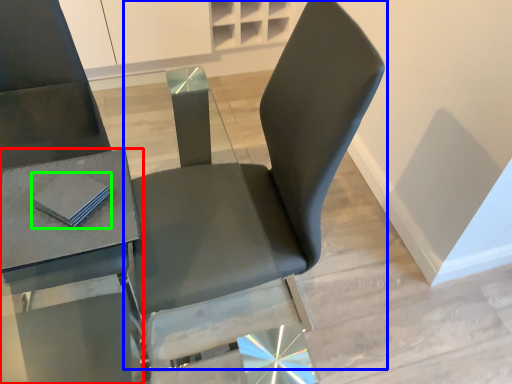
Question: Which is farther away from table (highlighted by a red box)? chair (highlighted by a blue box) or pad (highlighted by a green box)?

Choices:
 (A) chair
 (B) pad

Answer: (A)